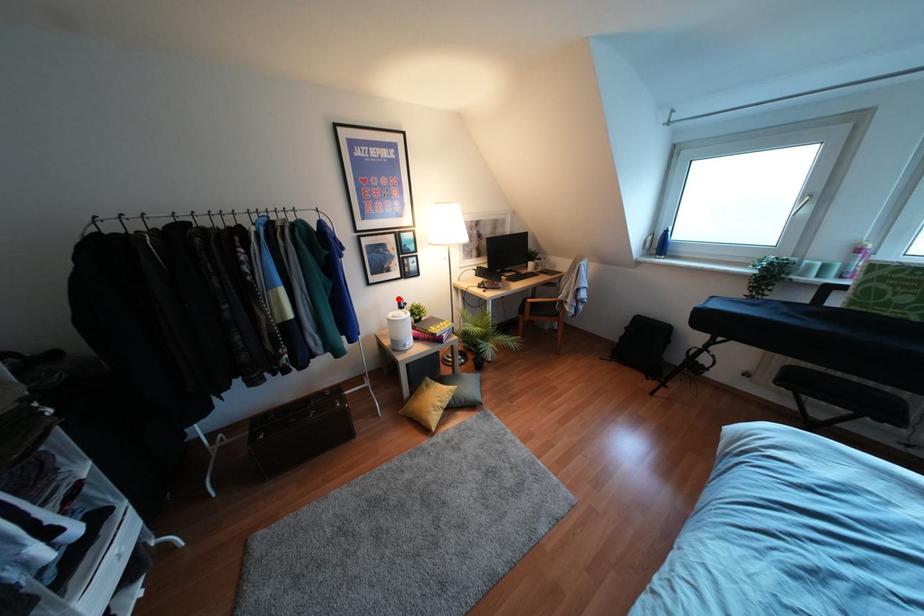
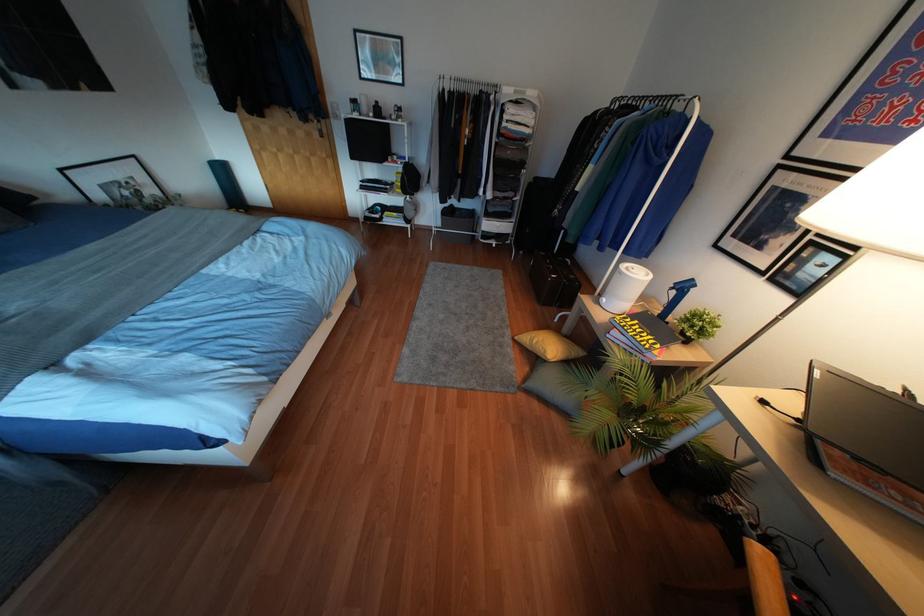
Where in the second image is the point corresponding to the highlighted location from the first image?

(690, 280)